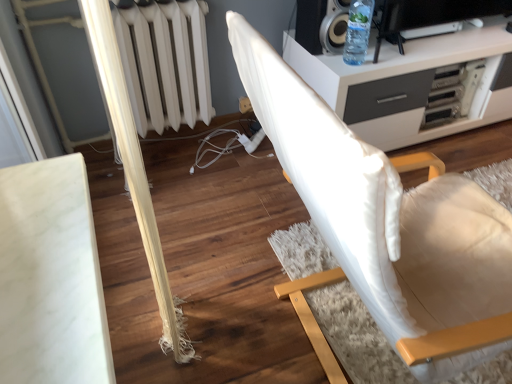
Question: Considering the relative positions of white fabric chair at center and clear plastic bottle at upper right in the image provided, is white fabric chair at center to the left or to the right of clear plastic bottle at upper right?

Choices:
 (A) left
 (B) right

Answer: (A)

Question: Is white fabric chair at center inside or outside of clear plastic bottle at upper right?

Choices:
 (A) inside
 (B) outside

Answer: (B)

Question: From the image's perspective, is white fabric chair at center located above or below clear plastic bottle at upper right?

Choices:
 (A) above
 (B) below

Answer: (B)

Question: From a real-world perspective, is clear plastic bottle at upper right physically located above or below white fabric chair at center?

Choices:
 (A) below
 (B) above

Answer: (B)

Question: Considering the positions of clear plastic bottle at upper right and white fabric chair at center in the image, is clear plastic bottle at upper right bigger or smaller than white fabric chair at center?

Choices:
 (A) big
 (B) small

Answer: (B)

Question: Considering their positions, is clear plastic bottle at upper right located in front of or behind white fabric chair at center?

Choices:
 (A) front
 (B) behind

Answer: (B)

Question: Looking at their shapes, would you say clear plastic bottle at upper right is wider or thinner than white fabric chair at center?

Choices:
 (A) thin
 (B) wide

Answer: (A)